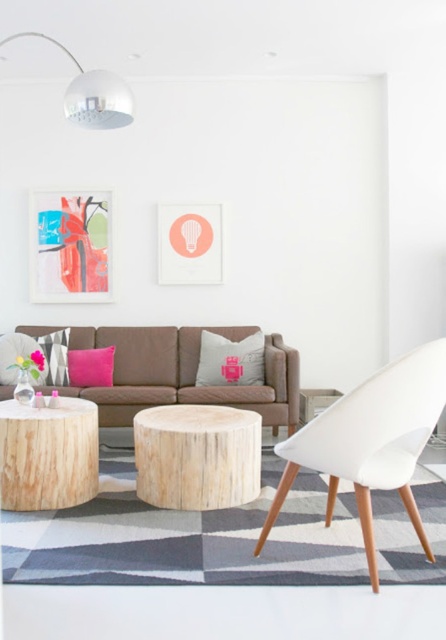
Who is more distant from viewer, (273, 371) or (86, 497)?

Point (273, 371)

Does brown fabric couch at center come behind natural wood side table at lower left?

Yes, it is behind natural wood side table at lower left.

Find the location of a particular element. The height and width of the screenshot is (640, 446). brown fabric couch at center is located at coordinates (184, 372).

Between brown fabric couch at center and gray fabric pillow at center, which one appears on the right side from the viewer's perspective?

gray fabric pillow at center

Consider the image. Between brown fabric couch at center and gray fabric pillow at center, which one appears on the left side from the viewer's perspective?

From the viewer's perspective, brown fabric couch at center appears more on the left side.

Does point (45, 332) come closer to viewer compared to point (243, 376)?

No, (45, 332) is further to viewer.

You are a GUI agent. You are given a task and a screenshot of the screen. Output one action in this format:
    pyautogui.click(x=<x>, y=<y>)
    Task: Click on the brown fabric couch at center
    The image size is (446, 640).
    Given the screenshot: What is the action you would take?
    pyautogui.click(x=184, y=372)

Who is shorter, white matte chair at center or natural wood side table at lower left?

With less height is natural wood side table at lower left.

Is white matte chair at center thinner than natural wood side table at lower left?

In fact, white matte chair at center might be wider than natural wood side table at lower left.

Find the location of a particular element. The height and width of the screenshot is (640, 446). white matte chair at center is located at coordinates (371, 442).